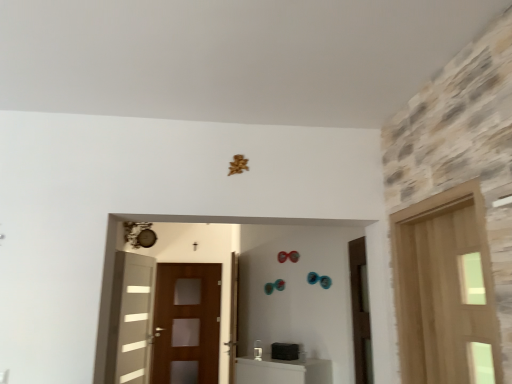
Question: Is brown matte door at right, positioned as the 2th door in front-to-back order, inside the boundaries of white glossy door at left, placed as the first door when sorted from left to right, or outside?

Choices:
 (A) outside
 (B) inside

Answer: (A)

Question: From a real-world perspective, is brown matte door at right, marked as the 3th door in a back-to-front arrangement, above or below white glossy door at left, placed as the first door when sorted from left to right?

Choices:
 (A) below
 (B) above

Answer: (B)

Question: Estimate the real-world distances between objects in this image. Which object is closer to the wooden door at center, the 3th door positioned from the front?

Choices:
 (A) white glossy door at left, which appears as the first door when viewed from the back
 (B) light wood door at right, which is counted as the first door, starting from the right
 (C) brown wooden screen door at center
 (D) brown matte door at right, positioned as the 2th door in front-to-back order

Answer: (C)

Question: Which of these objects is positioned closest to the white glossy door at left, arranged as the 4th door when viewed from the right?

Choices:
 (A) wooden door at center, the second door when ordered from back to front
 (B) light wood door at right, which is counted as the first door, starting from the front
 (C) brown wooden screen door at center
 (D) brown matte door at right, the 3th door positioned from the left

Answer: (C)